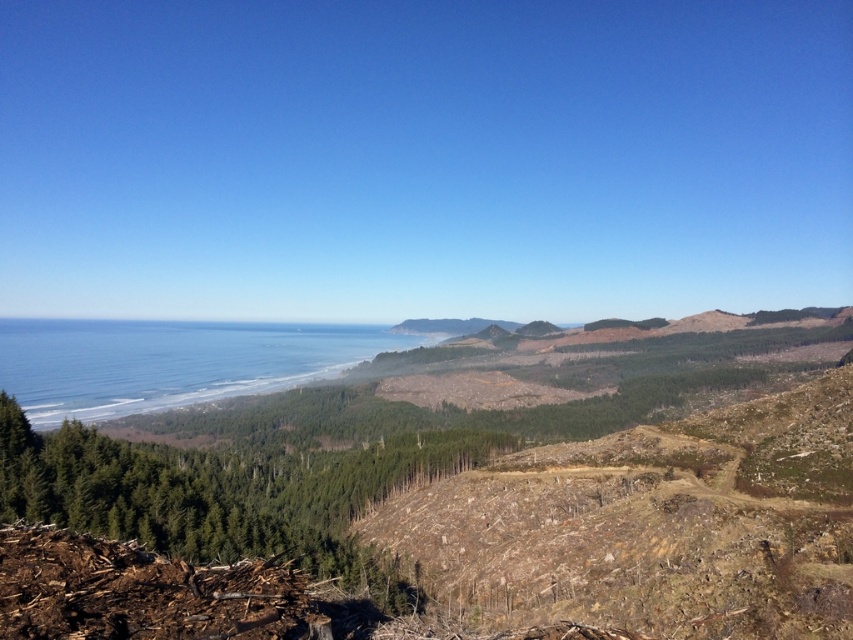
Question: Can you confirm if green textured trees at center is positioned to the left of blue water at center?

Choices:
 (A) yes
 (B) no

Answer: (B)

Question: Is green textured trees at center smaller than blue water at center?

Choices:
 (A) yes
 (B) no

Answer: (A)

Question: Does green textured trees at center appear on the left side of blue water at center?

Choices:
 (A) yes
 (B) no

Answer: (B)

Question: Which point is farther from the camera taking this photo?

Choices:
 (A) (108, 358)
 (B) (199, 458)

Answer: (A)

Question: Which point appears closest to the camera in this image?

Choices:
 (A) (119, 356)
 (B) (360, 506)

Answer: (B)